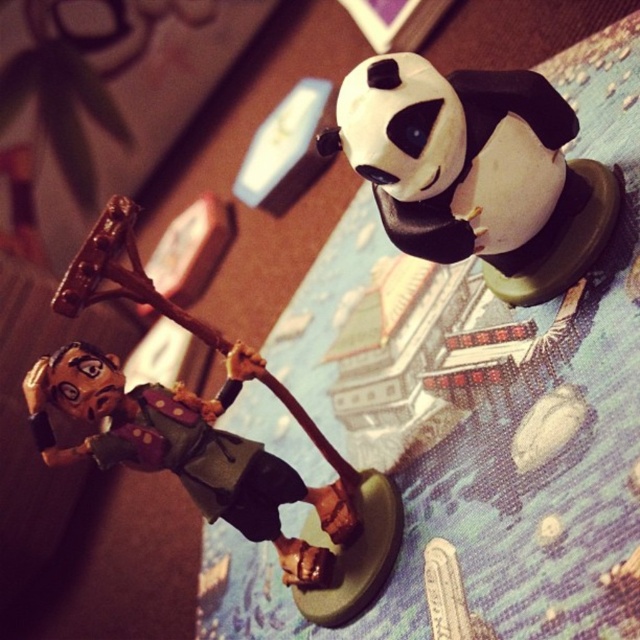
Question: Can you confirm if white matte panda at upper right is thinner than matte brown wood figure at center?

Choices:
 (A) yes
 (B) no

Answer: (A)

Question: Which object appears closest to the camera in this image?

Choices:
 (A) white matte panda at upper right
 (B) matte brown wood figure at center

Answer: (A)

Question: From the image, what is the correct spatial relationship of white matte panda at upper right in relation to matte brown wood figure at center?

Choices:
 (A) right
 (B) left

Answer: (A)

Question: Which of the following is the closest to the observer?

Choices:
 (A) (244, 470)
 (B) (532, 173)

Answer: (B)

Question: Observing the image, what is the correct spatial positioning of white matte panda at upper right in reference to matte brown wood figure at center?

Choices:
 (A) above
 (B) below

Answer: (A)